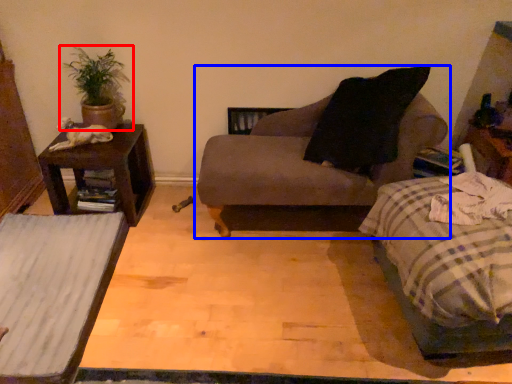
Question: Which object is further to the camera taking this photo, houseplant (highlighted by a red box) or chair (highlighted by a blue box)?

Choices:
 (A) houseplant
 (B) chair

Answer: (A)